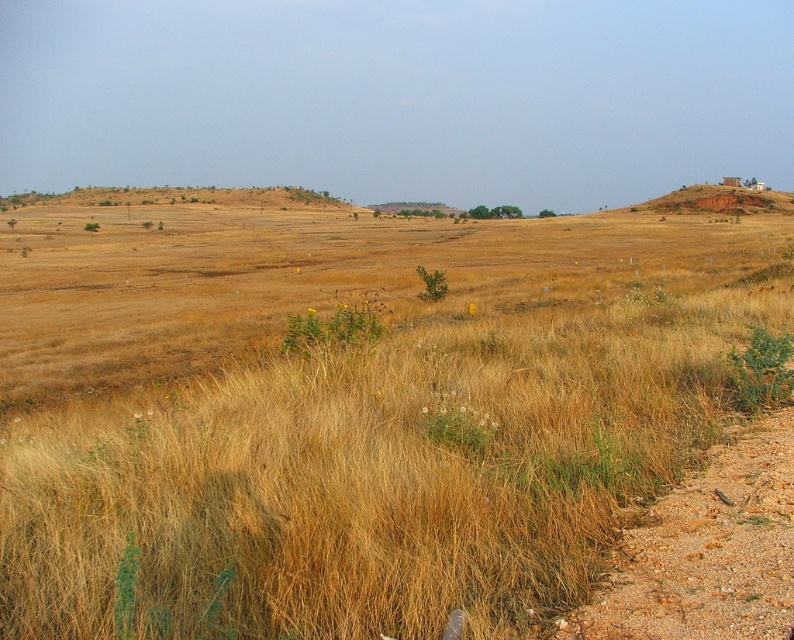
Between point (419, 403) and point (769, 605), which one is positioned in front?

Positioned in front is point (769, 605).

Is brown grassy field at center to the left of dirt/gravel path at lower right from the viewer's perspective?

Indeed, brown grassy field at center is positioned on the left side of dirt/gravel path at lower right.

You are a GUI agent. You are given a task and a screenshot of the screen. Output one action in this format:
    pyautogui.click(x=<x>, y=<y>)
    Task: Click on the brown grassy field at center
    The height and width of the screenshot is (640, 794).
    Given the screenshot: What is the action you would take?
    pyautogui.click(x=349, y=412)